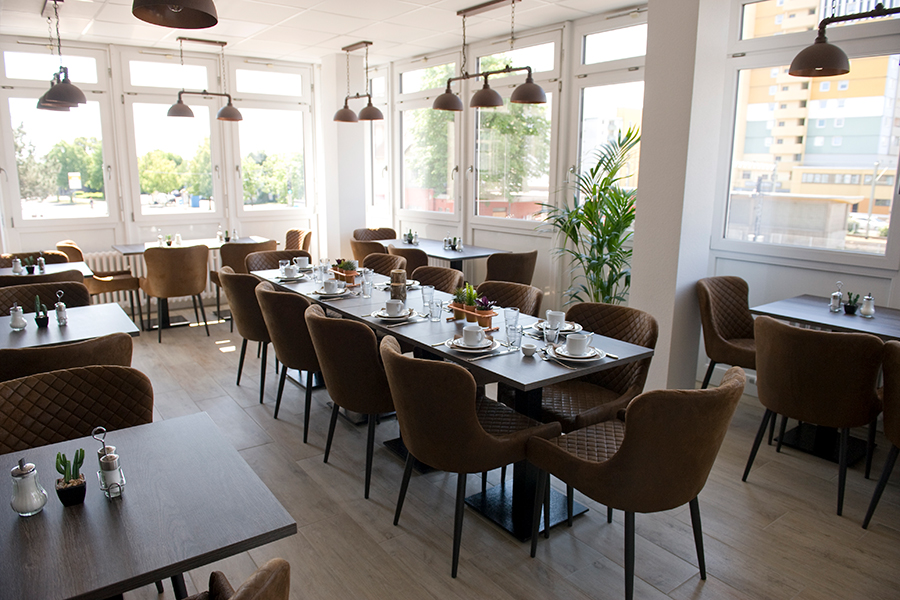
At what (x,y) coordinates should I click in order to perform the action: click on white plates. Please return your answer as a coordinate pair (x, y). This screenshot has height=600, width=900. Looking at the image, I should click on point(478,350), point(579,361), point(580,327), point(398,317), point(334,293), point(300,277), point(306,269), point(415,283), point(372,271).